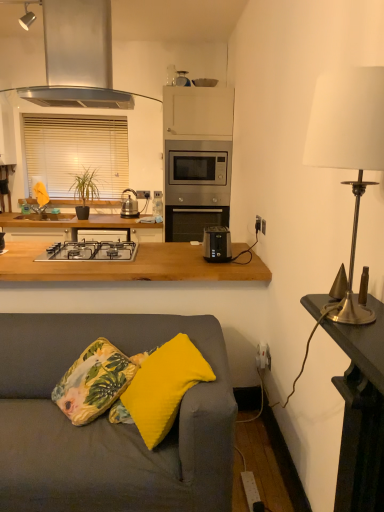
Find the location of a particular element. The width and height of the screenshot is (384, 512). empty space that is ontop of gold metallic table at right (from a real-world perspective) is located at coordinates (364, 308).